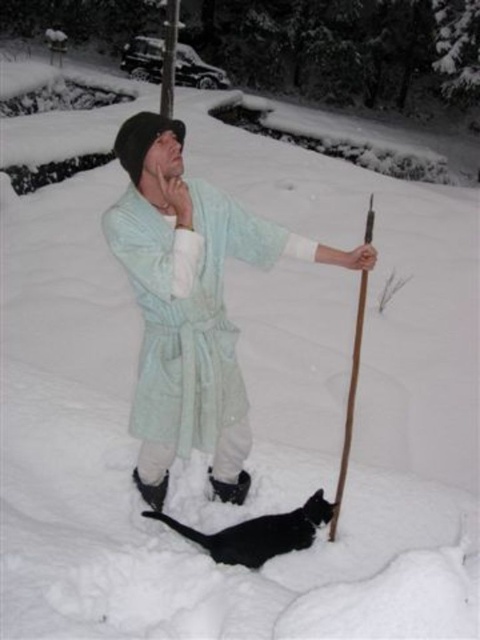
You are a delivery robot that needs to place a small package between the black fur cat at lower center and the brown wood ski pole at center. Can you fit the package there if it measures 20 inches in length?

The distance between the black fur cat at lower center and the brown wood ski pole at center is 31.14 inches. Since the package is 20 inches long, there is enough space to fit it between them.

Based on the photo, you are a photographer trying to capture the scene of a person in a light blue fabric robe at center and a brown wood ski pole at center. Which object should you focus on first if you want to ensure both are in sharp focus?

The light blue fabric robe at center is located below the brown wood ski pole at center, so you should focus on the brown wood ski pole at center first to ensure both are in sharp focus.

Looking at this image, you are a photographer trying to capture a photo of the black fur cat at lower center and the brown wood ski pole at center. Based on their positions, which object should you focus on first if you want to include both in the frame without moving the camera?

The black fur cat at lower center is located below the brown wood ski pole at center, so you should focus on the brown wood ski pole at center first to ensure both are in the frame.